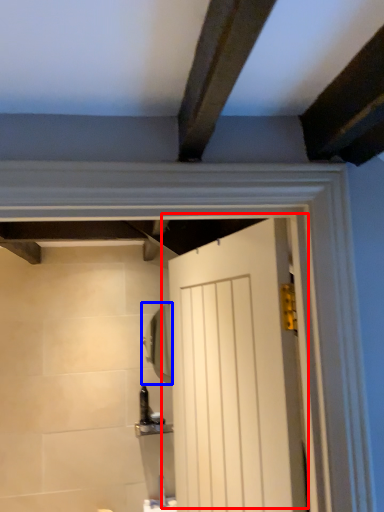
Question: Which point is further to the camera, door (highlighted by a red box) or mirror (highlighted by a blue box)?

Choices:
 (A) door
 (B) mirror

Answer: (B)